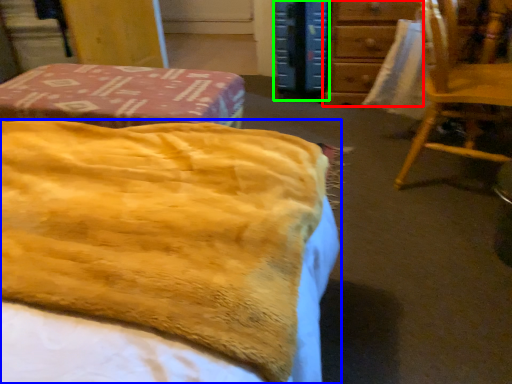
Question: Based on their relative distances, which object is farther from furniture (highlighted by a red box)? Choose from bed (highlighted by a blue box) and paperback book (highlighted by a green box).

Choices:
 (A) bed
 (B) paperback book

Answer: (A)